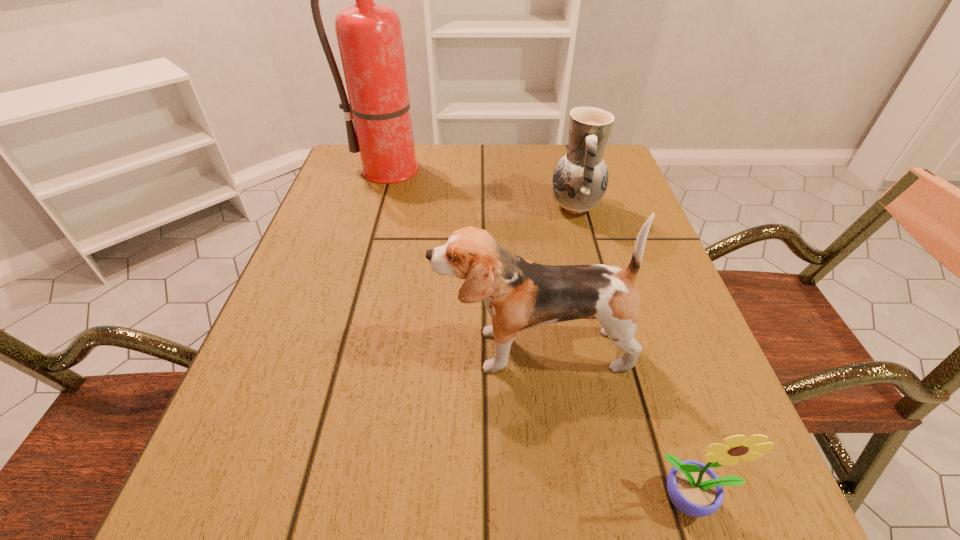
Locate an element on the screen. The image size is (960, 540). the farthest object is located at coordinates (369, 35).

Image resolution: width=960 pixels, height=540 pixels. I want to click on fire extinguisher, so click(369, 35).

This screenshot has width=960, height=540. I want to click on the second nearest object, so 519,294.

Where is `puppy`? puppy is located at coordinates (x=519, y=294).

Locate an element on the screen. The image size is (960, 540). the third tallest object is located at coordinates (580, 179).

Locate an element on the screen. pottery is located at coordinates (580, 179).

I want to click on sunflower, so pos(694,488).

You are a GUI agent. You are given a task and a screenshot of the screen. Output one action in this format:
    pyautogui.click(x=<x>, y=<y>)
    Task: Click on the nearest object
    The height and width of the screenshot is (540, 960).
    Given the screenshot: What is the action you would take?
    pyautogui.click(x=694, y=488)

In order to click on free space located 0.370m with the handle and hose on the tallest object in this screenshot , I will do `click(367, 291)`.

Identify the location of vacant space located 0.050m at the face of the second nearest object. Image resolution: width=960 pixels, height=540 pixels. point(406,350).